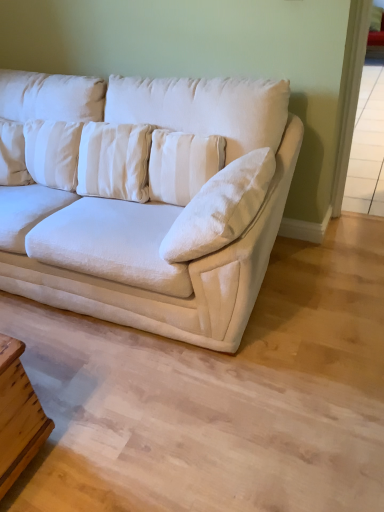
Where is `white fabric couch at center`? white fabric couch at center is located at coordinates (147, 208).

Describe the element at coordinates (147, 208) in the screenshot. I see `white fabric couch at center` at that location.

Find the location of a particular element. This screenshot has width=384, height=512. white fabric couch at center is located at coordinates (147, 208).